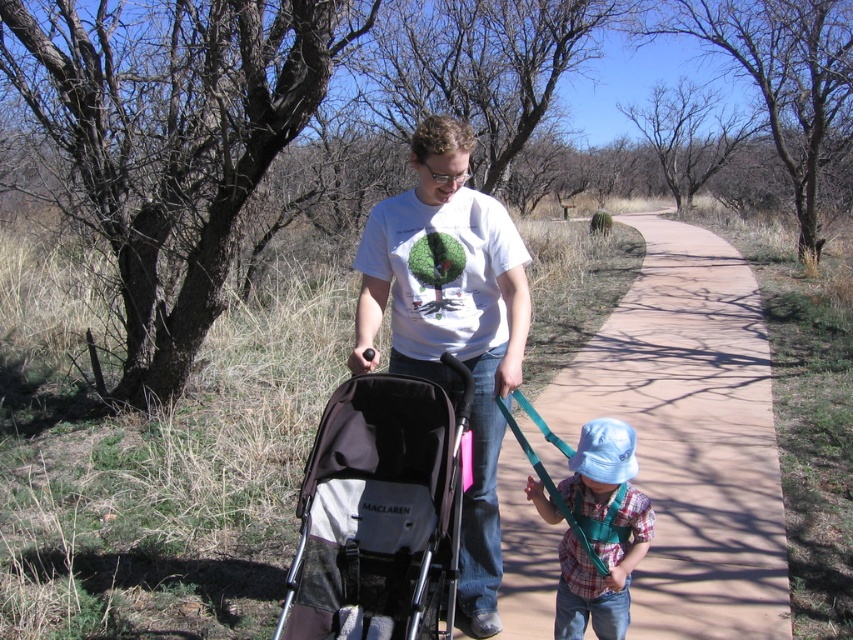
Is paved concrete path at center below white t-shirt at center?

No, paved concrete path at center is not below white t-shirt at center.

Where is `paved concrete path at center`? paved concrete path at center is located at coordinates (691, 435).

Between point (695, 364) and point (306, 596), which one is positioned behind?

The point (695, 364) is behind.

Which is behind, point (766, 467) or point (323, 593)?

Positioned behind is point (766, 467).

Locate an element on the screen. paved concrete path at center is located at coordinates (691, 435).

The height and width of the screenshot is (640, 853). What do you see at coordinates (379, 513) in the screenshot? I see `dark gray fabric stroller at center` at bounding box center [379, 513].

You are a GUI agent. You are given a task and a screenshot of the screen. Output one action in this format:
    pyautogui.click(x=<x>, y=<y>)
    Task: Click on the dark gray fabric stroller at center
    This screenshot has width=853, height=640.
    Given the screenshot: What is the action you would take?
    pyautogui.click(x=379, y=513)